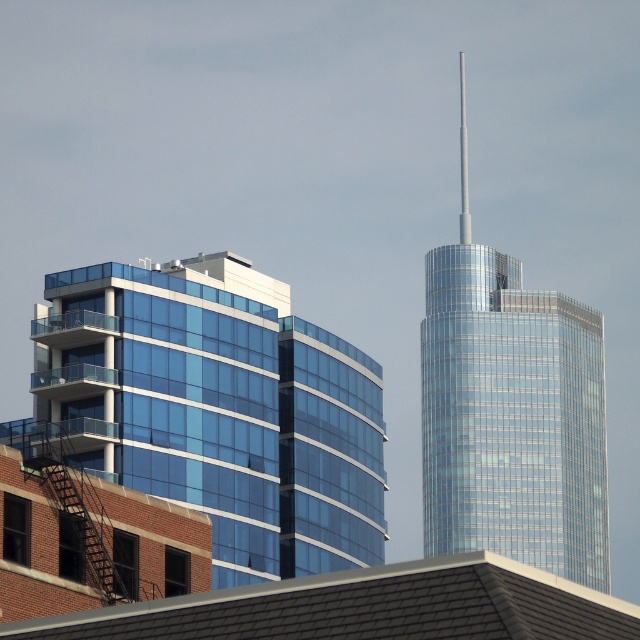
You are an architect analyzing the two buildings in the image. Based on their appearances, which building could potentially accommodate more floor space due to its width? Please consider the transparent glass building at left and the shiny glass tower at right in your analysis.

The transparent glass building at left might be wider than shiny glass tower at right, so it could potentially accommodate more floor space due to its greater width.

You are standing at a viewpoint where you can see both the transparent glass building at left and the shiny glass tower at right. Which building appears lower in the image?

The transparent glass building at left appears lower because it is located below the shiny glass tower at right in the image.

You are standing at a viewpoint where you can see both the transparent glass building at left and the traditional skyscraper at right. If you want to take a photo that includes both buildings in the frame, which building should you position closer to the camera to ensure both are visible?

To include both the transparent glass building at left and the traditional skyscraper at right in the frame, you should position yourself closer to the transparent glass building at left since it is closer to the viewer than the traditional skyscraper at right. This allows the camera to capture both buildings within the same shot without one being too far away.